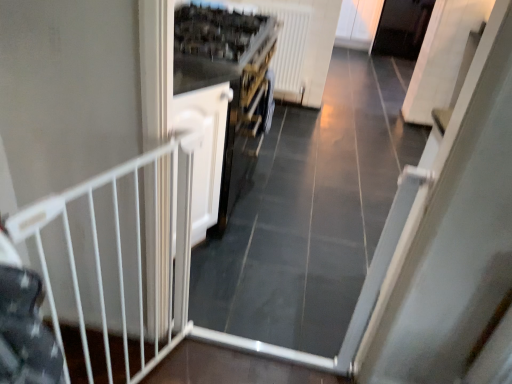
Question: Can you confirm if white plastic radiator at upper center is bigger than white metal gate at left?

Choices:
 (A) no
 (B) yes

Answer: (B)

Question: Is white plastic radiator at upper center shorter than white metal gate at left?

Choices:
 (A) no
 (B) yes

Answer: (B)

Question: Is white plastic radiator at upper center not within white metal gate at left?

Choices:
 (A) no
 (B) yes

Answer: (B)

Question: Is white plastic radiator at upper center positioned before white metal gate at left?

Choices:
 (A) yes
 (B) no

Answer: (B)

Question: From the image's perspective, is white plastic radiator at upper center located beneath white metal gate at left?

Choices:
 (A) no
 (B) yes

Answer: (A)

Question: Would you say white plastic radiator at upper center is to the left or to the right of white metal gate at left in the picture?

Choices:
 (A) left
 (B) right

Answer: (B)

Question: Considering the positions of white plastic radiator at upper center and white metal gate at left in the image, is white plastic radiator at upper center bigger or smaller than white metal gate at left?

Choices:
 (A) big
 (B) small

Answer: (A)

Question: Relative to white metal gate at left, is white plastic radiator at upper center in front or behind?

Choices:
 (A) front
 (B) behind

Answer: (B)

Question: Considering the positions of white plastic radiator at upper center and white metal gate at left in the image, is white plastic radiator at upper center wider or thinner than white metal gate at left?

Choices:
 (A) thin
 (B) wide

Answer: (B)

Question: From the image's perspective, is white matte door at center above or below white plastic radiator at upper center?

Choices:
 (A) above
 (B) below

Answer: (B)

Question: In the image, is white matte door at center on the left side or the right side of white plastic radiator at upper center?

Choices:
 (A) right
 (B) left

Answer: (B)

Question: From their relative heights in the image, would you say white matte door at center is taller or shorter than white plastic radiator at upper center?

Choices:
 (A) short
 (B) tall

Answer: (A)

Question: Based on their sizes in the image, would you say white matte door at center is bigger or smaller than white plastic radiator at upper center?

Choices:
 (A) big
 (B) small

Answer: (A)

Question: Considering the positions of white matte door at center and white metal gate at left in the image, is white matte door at center taller or shorter than white metal gate at left?

Choices:
 (A) tall
 (B) short

Answer: (B)

Question: Choose the correct answer: Is white matte door at center inside white metal gate at left or outside it?

Choices:
 (A) outside
 (B) inside

Answer: (A)